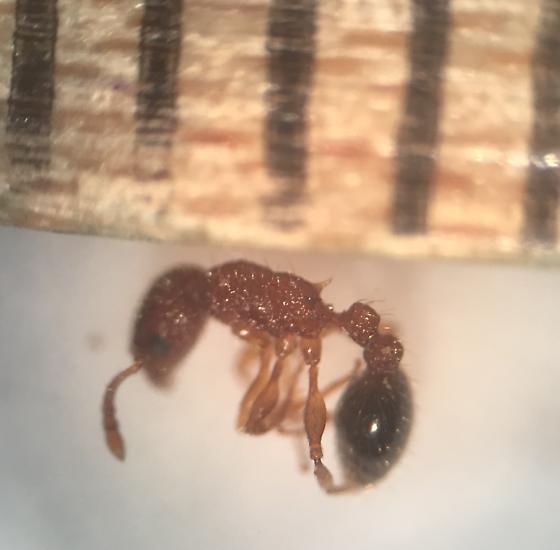
Find the location of a particular element. light reflecting on wood is located at coordinates (548, 158), (490, 155).